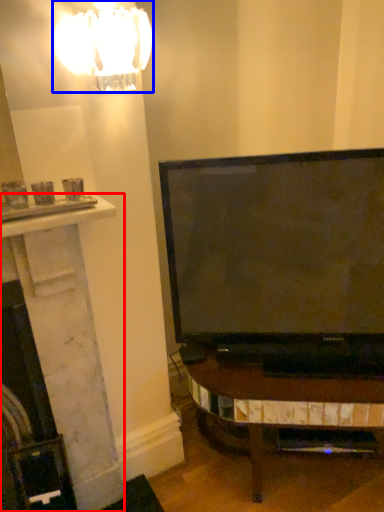
Question: Which object is closer to the camera taking this photo, fireplace (highlighted by a red box) or lamp (highlighted by a blue box)?

Choices:
 (A) fireplace
 (B) lamp

Answer: (B)